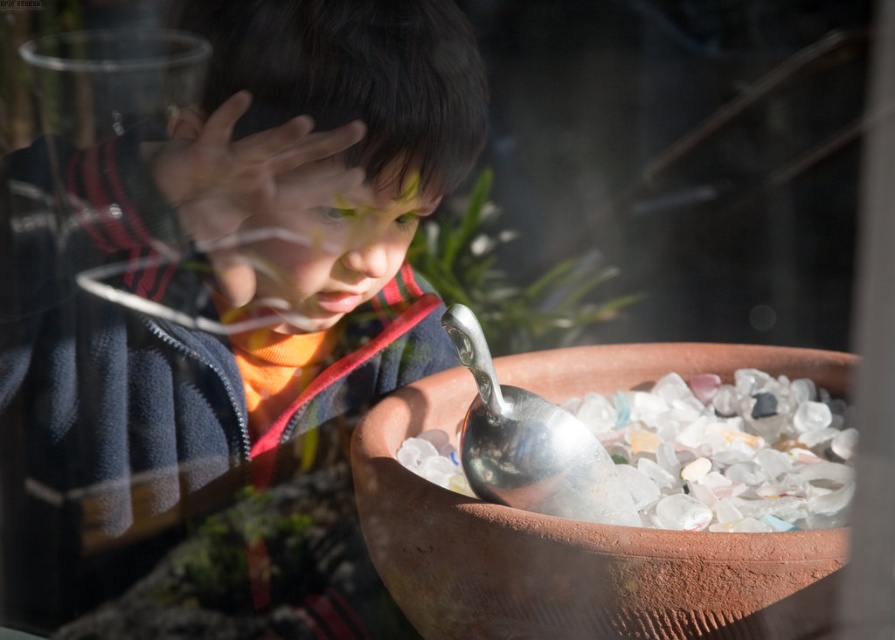
Between point (249, 204) and point (452, 323), which one is positioned in front?

Point (452, 323) is in front.

Does smooth skin hand at center appear on the left side of silver metallic spoon at lower center?

Yes, smooth skin hand at center is to the left of silver metallic spoon at lower center.

This screenshot has width=895, height=640. Describe the element at coordinates (261, 198) in the screenshot. I see `smooth skin hand at center` at that location.

The image size is (895, 640). Find the location of `smooth skin hand at center`. smooth skin hand at center is located at coordinates (261, 198).

Between matte black jacket at upper left and silver metallic spoon at lower center, which one is positioned lower?

silver metallic spoon at lower center

Locate an element on the screen. matte black jacket at upper left is located at coordinates (226, 323).

Which is in front, point (367, 4) or point (235, 104)?

Positioned in front is point (235, 104).

Can you confirm if matte black jacket at upper left is bigger than smooth skin hand at center?

Indeed, matte black jacket at upper left has a larger size compared to smooth skin hand at center.

Measure the distance between matte black jacket at upper left and camera.

24.03 inches

Where is `matte black jacket at upper left`? This screenshot has width=895, height=640. matte black jacket at upper left is located at coordinates (226, 323).